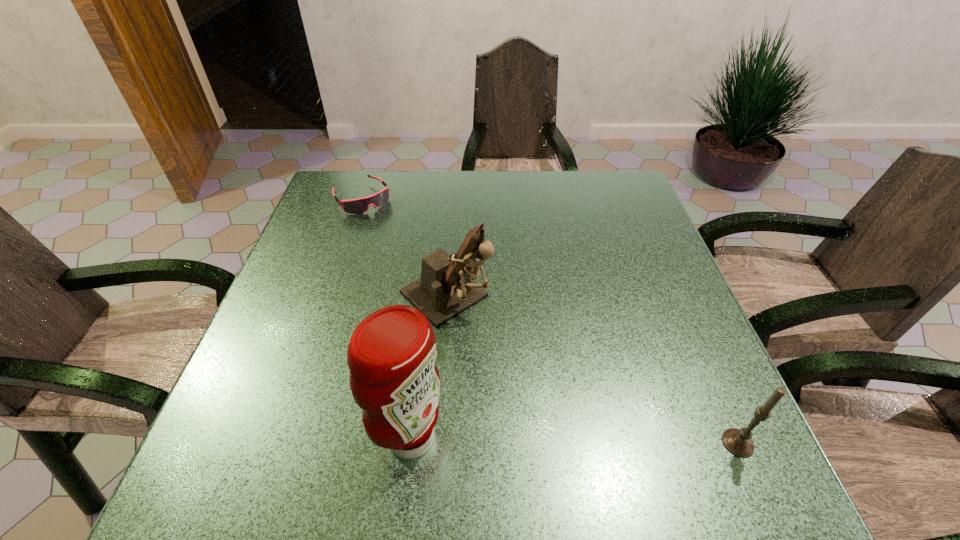
I want to click on vacant area between the condiment and the second shortest object, so click(574, 440).

Locate an element on the screen. This screenshot has width=960, height=540. free area in between the rightmost object and the condiment is located at coordinates (574, 440).

Where is `free spot between the second shortest object and the condiment`? This screenshot has height=540, width=960. free spot between the second shortest object and the condiment is located at coordinates (574, 440).

Point out which object is positioned as the third nearest to the figurine. Please provide its 2D coordinates. Your answer should be formatted as a tuple, i.e. [(x, y)], where the tuple contains the x and y coordinates of a point satisfying the conditions above.

[(738, 442)]

Identify the location of the third closest object to the figurine. (738, 442).

Identify the location of vacant position in the image that satisfies the following two spatial constraints: 1. on the front side of the goggles; 2. on the right side of the rightmost object. The height and width of the screenshot is (540, 960). (278, 443).